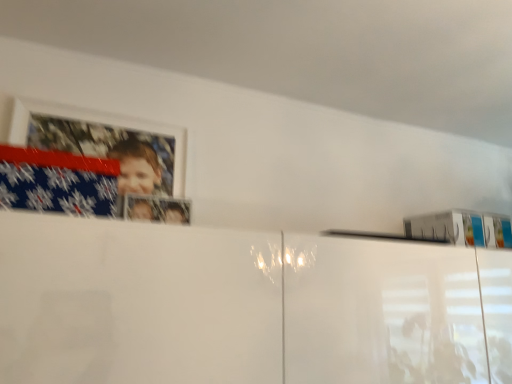
Question: From the image's perspective, is white glossy picture frame at upper left located above or below blue fabric flag at upper left?

Choices:
 (A) below
 (B) above

Answer: (B)

Question: Do you think white glossy picture frame at upper left is within blue fabric flag at upper left, or outside of it?

Choices:
 (A) outside
 (B) inside

Answer: (A)

Question: Is white glossy picture frame at upper left taller or shorter than blue fabric flag at upper left?

Choices:
 (A) tall
 (B) short

Answer: (A)

Question: Is blue fabric flag at upper left bigger or smaller than white glossy picture frame at upper left?

Choices:
 (A) big
 (B) small

Answer: (A)

Question: Considering the positions of blue fabric flag at upper left and white glossy picture frame at upper left in the image, is blue fabric flag at upper left wider or thinner than white glossy picture frame at upper left?

Choices:
 (A) thin
 (B) wide

Answer: (B)

Question: Does point (53, 178) appear closer or farther from the camera than point (163, 139)?

Choices:
 (A) farther
 (B) closer

Answer: (B)

Question: Would you say blue fabric flag at upper left is inside or outside white glossy picture frame at upper left?

Choices:
 (A) inside
 (B) outside

Answer: (B)